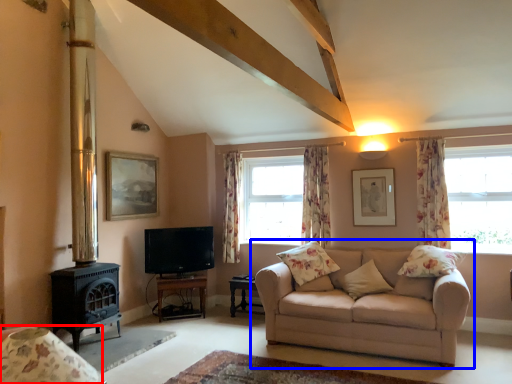
Question: Which object appears closest to the camera in this image, armchair (highlighted by a red box) or studio couch (highlighted by a blue box)?

Choices:
 (A) armchair
 (B) studio couch

Answer: (A)